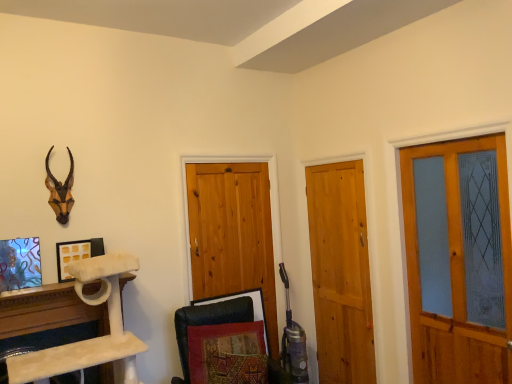
The height and width of the screenshot is (384, 512). In order to click on free point above light brown wooden door at center, which is counted as the first barn door, starting from the right (from a real-world perspective) in this screenshot , I will do `click(329, 161)`.